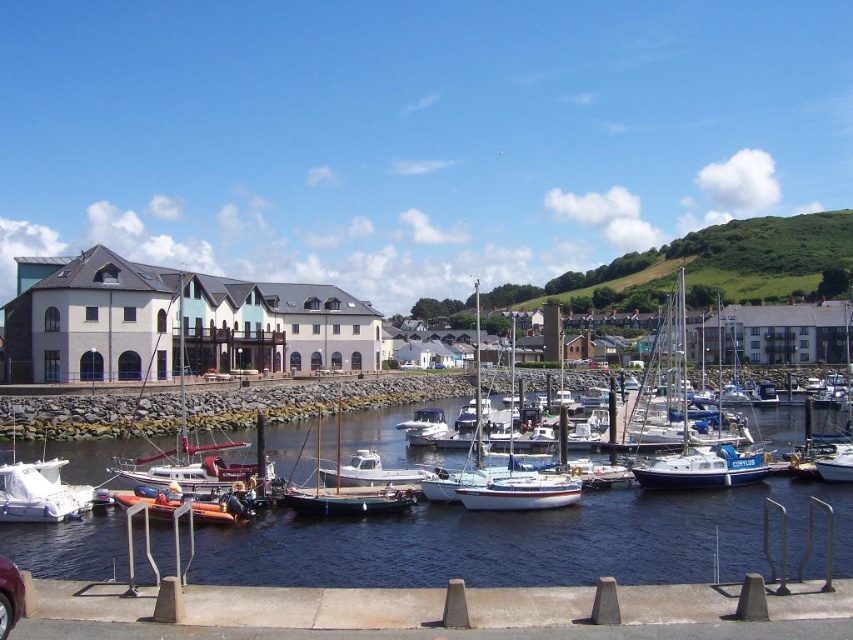
Which of these two, smooth concrete dock at lower center or orange rubber dinghy at lower left, stands shorter?

With less height is smooth concrete dock at lower center.

Is smooth concrete dock at lower center shorter than orange rubber dinghy at lower left?

Indeed, smooth concrete dock at lower center has a lesser height compared to orange rubber dinghy at lower left.

Locate an element on the screen. smooth concrete dock at lower center is located at coordinates (430, 612).

In the scene shown: Is clear water at center thinner than blue matte sailboat at center?

Correct, clear water at center's width is less than blue matte sailboat at center's.

Between clear water at center and blue matte sailboat at center, which one has less height?

Standing shorter between the two is clear water at center.

Which is in front, point (793, 524) or point (700, 451)?

Positioned in front is point (793, 524).

Locate an element on the screen. clear water at center is located at coordinates (527, 541).

Is smooth concrete dock at lower center positioned behind metallic red car at lower left?

That is True.

Who is taller, smooth concrete dock at lower center or metallic red car at lower left?

smooth concrete dock at lower center

What do you see at coordinates (430, 612) in the screenshot? This screenshot has height=640, width=853. I see `smooth concrete dock at lower center` at bounding box center [430, 612].

What are the coordinates of `smooth concrete dock at lower center` in the screenshot? It's located at (430, 612).